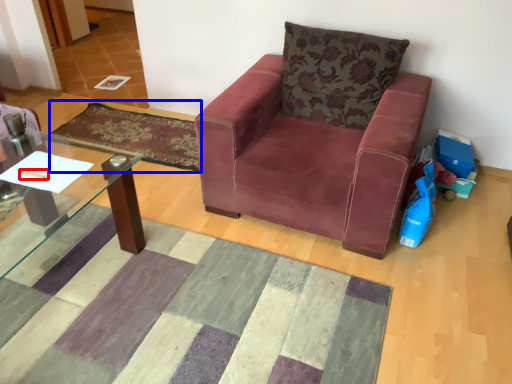
Question: Which object is closer to the camera taking this photo, pen (highlighted by a red box) or mat (highlighted by a blue box)?

Choices:
 (A) pen
 (B) mat

Answer: (A)